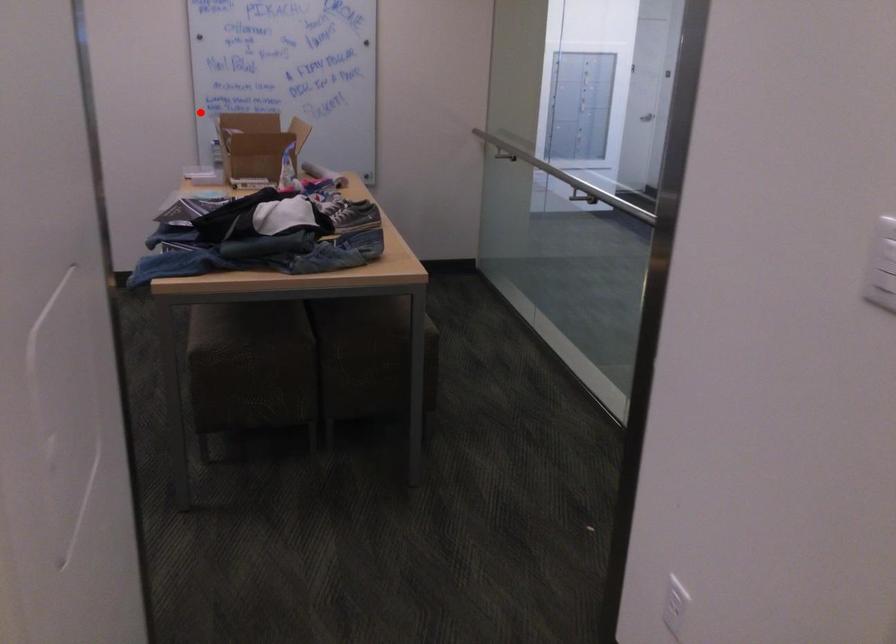
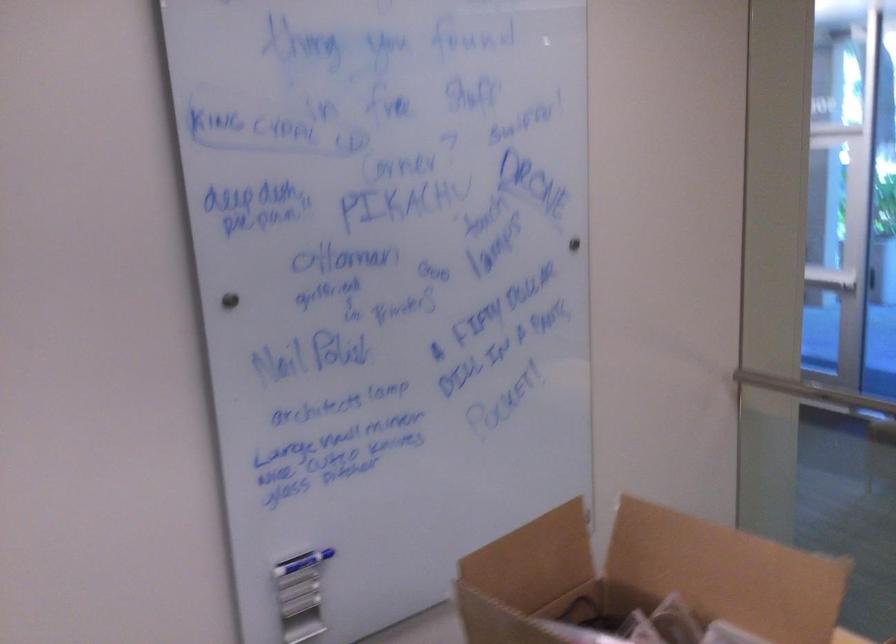
Question: I am providing you with two images of the same scene from different viewpoints. Given a red point in image1, look at the same physical point in image2. Is it:

Choices:
 (A) Closer to the viewpoint
 (B) Farther from the viewpoint

Answer: (A)